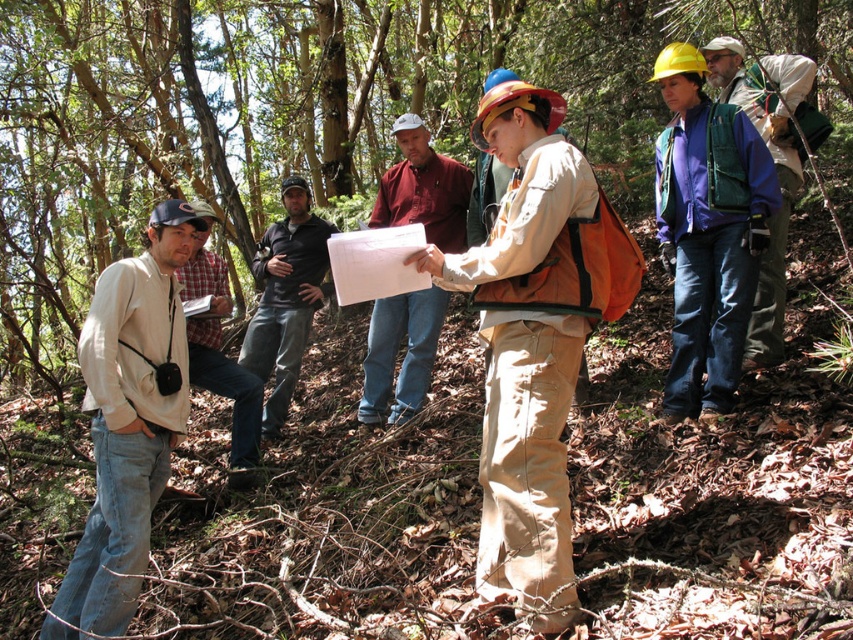
Is khaki cotton pants at center bigger than black cotton shirt at center?

Actually, khaki cotton pants at center might be smaller than black cotton shirt at center.

Between point (561, 362) and point (316, 257), which one is positioned in front?

Point (561, 362)

Where is `khaki cotton pants at center`? khaki cotton pants at center is located at coordinates (527, 461).

Who is lower down, light beige cotton shirt at left or black cotton shirt at center?

light beige cotton shirt at left

Describe the element at coordinates (128, 422) in the screenshot. I see `light beige cotton shirt at left` at that location.

Between point (141, 266) and point (287, 234), which one is positioned in front?

Point (141, 266) is in front.

Find the location of a particular element. light beige cotton shirt at left is located at coordinates (128, 422).

Does point (467, 168) come closer to viewer compared to point (285, 280)?

No, it is behind (285, 280).

Between point (415, 392) and point (276, 280), which one is positioned behind?

The point (276, 280) is behind.

Is point (434, 180) positioned behind point (274, 422)?

No, it is not.

I want to click on maroon cotton shirt at center, so click(x=404, y=355).